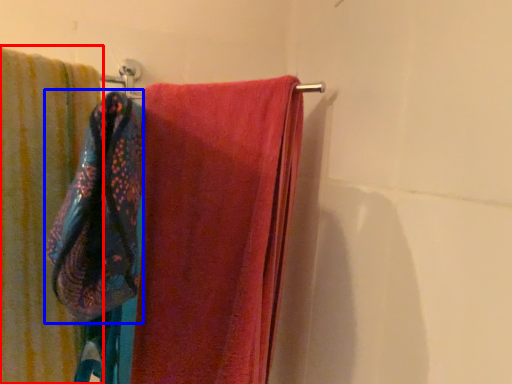
Question: Among these objects, which one is farthest to the camera, towel (highlighted by a red box) or beach towel (highlighted by a blue box)?

Choices:
 (A) towel
 (B) beach towel

Answer: (A)